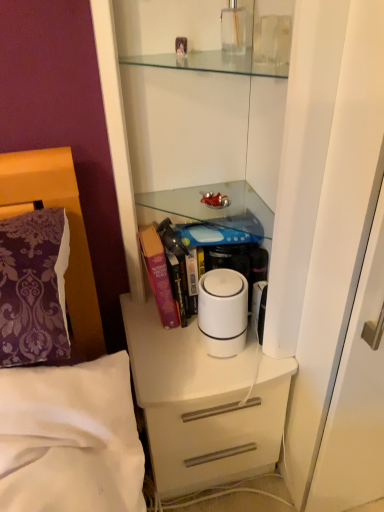
Describe the element at coordinates (223, 312) in the screenshot. The height and width of the screenshot is (512, 384). I see `white plastic humidifier at center` at that location.

The height and width of the screenshot is (512, 384). Describe the element at coordinates (213, 233) in the screenshot. I see `purple hardcover book at center` at that location.

This screenshot has height=512, width=384. What are the coordinates of `white plastic humidifier at center` in the screenshot? It's located at pyautogui.click(x=223, y=312).

Is the surface of purple hardcover book at center in direct contact with white matte chest of drawers at center?

No.

Which object is more forward, purple hardcover book at center or white matte chest of drawers at center?

Positioned in front is white matte chest of drawers at center.

Considering the sizes of objects purple hardcover book at center and white matte chest of drawers at center in the image provided, who is thinner, purple hardcover book at center or white matte chest of drawers at center?

With smaller width is purple hardcover book at center.

From the image's perspective, is white matte chest of drawers at center on top of white plastic humidifier at center?

No, from the image's perspective, white matte chest of drawers at center is not over white plastic humidifier at center.

Measure the distance between white matte chest of drawers at center and white plastic humidifier at center.

A distance of 7.40 inches exists between white matte chest of drawers at center and white plastic humidifier at center.

From a real-world perspective, who is located higher, white matte chest of drawers at center or white plastic humidifier at center?

From a 3D spatial view, white plastic humidifier at center is above.

Is white matte chest of drawers at center surrounding white plastic humidifier at center?

Actually, white plastic humidifier at center is outside white matte chest of drawers at center.

Is white matte chest of drawers at center bigger or smaller than purple hardcover book at center?

Answer: In the image, white matte chest of drawers at center appears to be larger than purple hardcover book at center.

Can you confirm if white matte chest of drawers at center is thinner than purple hardcover book at center?

No.

Can you tell me how much white matte chest of drawers at center and purple hardcover book at center differ in facing direction?

They differ by 3.83 degrees in their facing directions.

From the image's perspective, between white matte chest of drawers at center and purple hardcover book at center, who is located below?

white matte chest of drawers at center appears lower in the image.

Between white plastic humidifier at center and white matte chest of drawers at center, which one is positioned behind?

white matte chest of drawers at center is behind.

How much distance is there between white plastic humidifier at center and white matte chest of drawers at center?

The distance of white plastic humidifier at center from white matte chest of drawers at center is 18.79 centimeters.

Consider the image. In the image, is white plastic humidifier at center on the left side or the right side of white matte chest of drawers at center?

white plastic humidifier at center is to the right of white matte chest of drawers at center.

Is white plastic humidifier at center far from white matte chest of drawers at center?

No, white plastic humidifier at center is not far from white matte chest of drawers at center.

Is purple hardcover book at center surrounded by white plastic humidifier at center?

No, purple hardcover book at center is not inside white plastic humidifier at center.

From a real-world perspective, between white plastic humidifier at center and purple hardcover book at center, who is vertically higher?

In real-world perspective, purple hardcover book at center is above.

In terms of height, does white plastic humidifier at center look taller or shorter compared to purple hardcover book at center?

In the image, white plastic humidifier at center appears to be shorter than purple hardcover book at center.

Which is in front, point (206, 240) or point (241, 342)?

The point (206, 240) is more forward.

Can you confirm if purple hardcover book at center is shorter than white plastic humidifier at center?

No.

Are purple hardcover book at center and white plastic humidifier at center located far from each other?

purple hardcover book at center is actually quite close to white plastic humidifier at center.

Does purple hardcover book at center turn towards white plastic humidifier at center?

Yes, purple hardcover book at center is aimed at white plastic humidifier at center.

Find the location of `book lying on the right of white matte chest of drawers at center`. book lying on the right of white matte chest of drawers at center is located at coordinates (213, 233).

Find the location of `home appliance in front of the white matte chest of drawers at center`. home appliance in front of the white matte chest of drawers at center is located at coordinates [x=223, y=312].

Consider the image. Looking at the image, which one is located further to purple hardcover book at center, white plastic humidifier at center or white matte chest of drawers at center?

Based on the image, white matte chest of drawers at center appears to be further to purple hardcover book at center.

When comparing their distances from purple hardcover book at center, does white matte chest of drawers at center or white plastic humidifier at center seem closer?

white plastic humidifier at center lies closer to purple hardcover book at center than the other object.

Considering their positions, is white matte chest of drawers at center positioned further to white plastic humidifier at center than purple hardcover book at center?

white matte chest of drawers at center is further to white plastic humidifier at center.

When comparing their distances from white matte chest of drawers at center, does purple hardcover book at center or white plastic humidifier at center seem closer?

Based on the image, white plastic humidifier at center appears to be nearer to white matte chest of drawers at center.

Estimate the real-world distances between objects in this image. Which object is closer to white plastic humidifier at center, purple hardcover book at center or white matte chest of drawers at center?

Based on the image, purple hardcover book at center appears to be nearer to white plastic humidifier at center.

Looking at this image, when comparing their distances from white matte chest of drawers at center, does white plastic humidifier at center or purple hardcover book at center seem closer?

white plastic humidifier at center lies closer to white matte chest of drawers at center than the other object.

I want to click on home appliance between purple hardcover book at center and white matte chest of drawers at center vertically, so click(x=223, y=312).